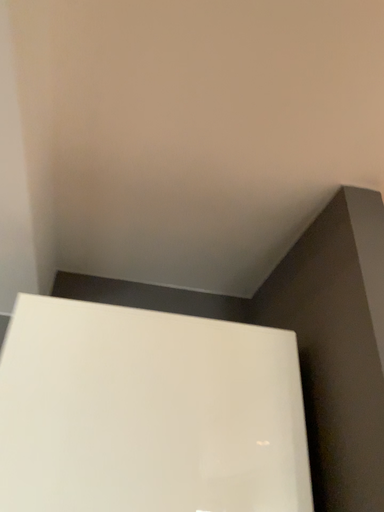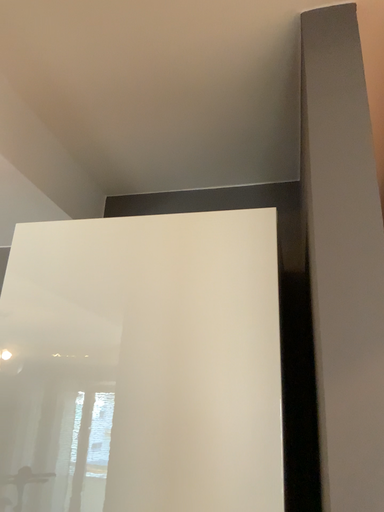
Question: Which way did the camera rotate in the video?

Choices:
 (A) rotated left
 (B) rotated right

Answer: (A)